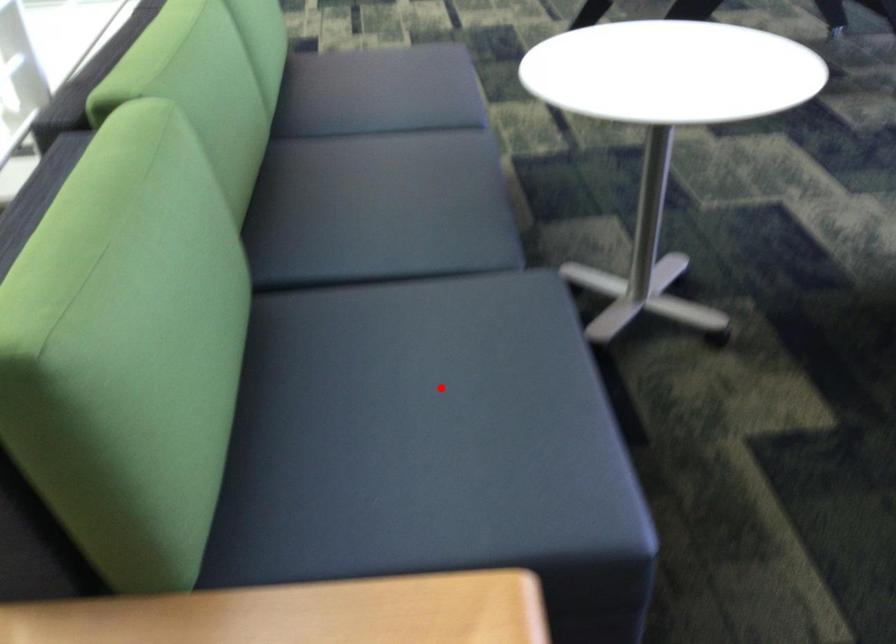
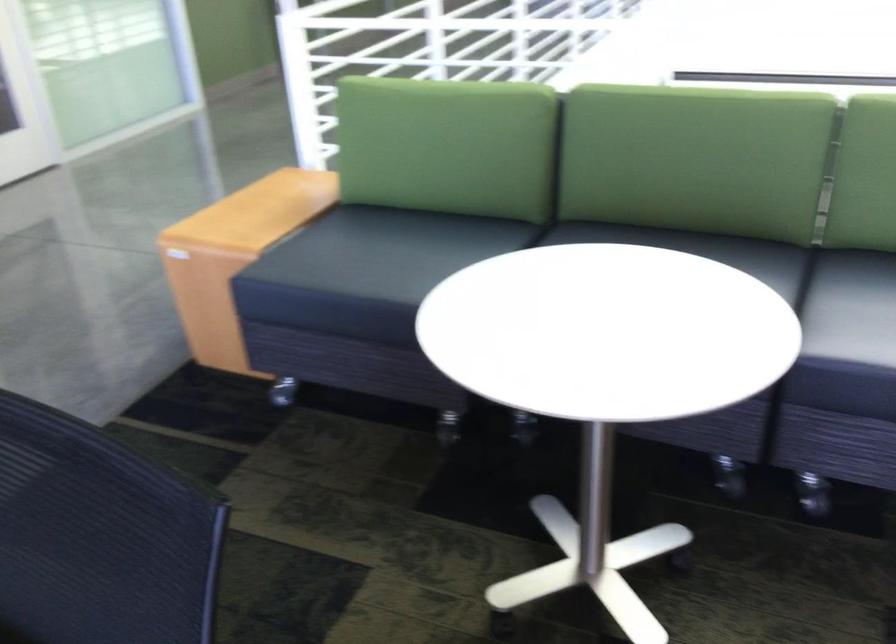
Where in the second image is the point corresponding to the highlighted location from the first image?

(383, 251)